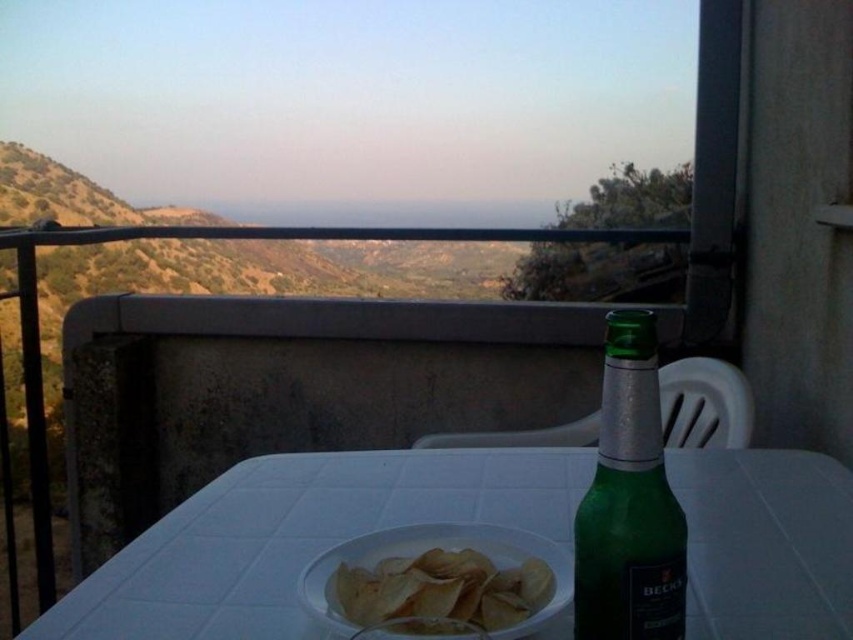
You are a waiter at a restaurant overlooking hills. You need to place a new order of chips on the table where there is already a green glass bottle at center right and golden crispy chips at center. Where should you place the new chips so they don not fall off the table?

The golden crispy chips at center are already on the table. Since the green glass bottle at center right is much taller, you can place the new chips near the bottle to utilize its height as a barrier to prevent them from sliding off the table.

You are standing on the balcony and want to pick up both items at point [283,540] and point [469,554]. Which item should you reach for first to avoid blocking your view of the other?

You should reach for point [283,540] first because it is closer to you than point [469,554], so grabbing it first won